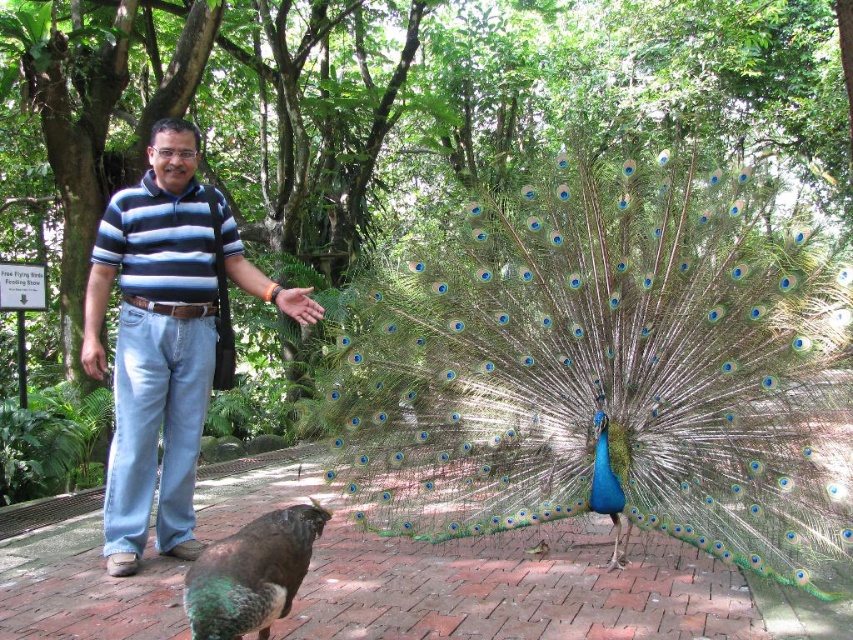
Between blue glossy peacock at center and green iridescent feathers at lower left, which one has more height?

blue glossy peacock at center is taller.

Which is behind, point (596, 211) or point (234, 618)?

Positioned behind is point (596, 211).

Find the location of `blue glossy peacock at center`. blue glossy peacock at center is located at coordinates click(x=607, y=368).

Where is `blue glossy peacock at center`? blue glossy peacock at center is located at coordinates (607, 368).

Can you confirm if blue striped shirt at center is positioned to the right of blue striped polo shirt at center?

Correct, you'll find blue striped shirt at center to the right of blue striped polo shirt at center.

Which is above, blue striped shirt at center or blue striped polo shirt at center?

blue striped polo shirt at center is higher up.

Describe the element at coordinates (154, 346) in the screenshot. I see `blue striped shirt at center` at that location.

Where is `blue striped shirt at center`? blue striped shirt at center is located at coordinates (154, 346).

Between blue glossy peacock at center and blue striped polo shirt at center, which one appears on the left side from the viewer's perspective?

blue striped polo shirt at center

Is blue glossy peacock at center to the right of blue striped polo shirt at center from the viewer's perspective?

Yes, blue glossy peacock at center is to the right of blue striped polo shirt at center.

Is point (740, 474) positioned after point (194, 241)?

No, (740, 474) is closer to viewer.

This screenshot has height=640, width=853. Identify the location of blue glossy peacock at center. (607, 368).